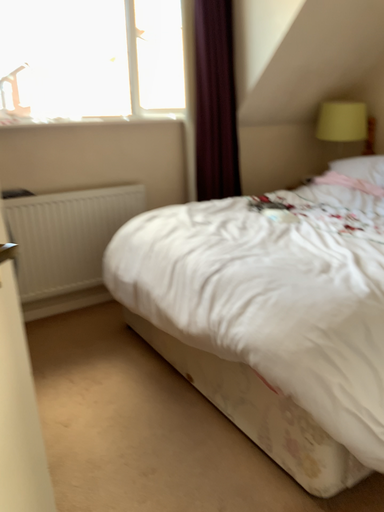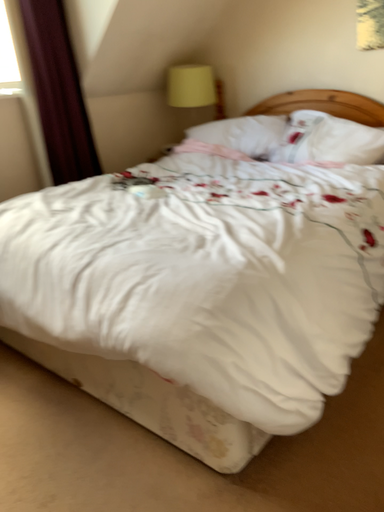
Question: Which way did the camera rotate in the video?

Choices:
 (A) rotated right
 (B) rotated left

Answer: (A)